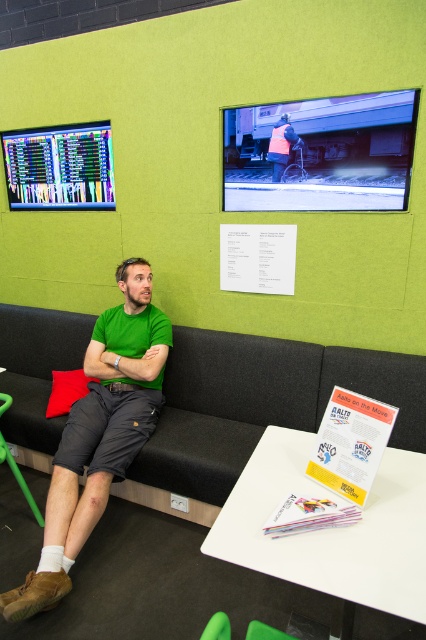
Which is more to the right, white glossy table at lower right or green matte shirt at center?

From the viewer's perspective, white glossy table at lower right appears more on the right side.

What do you see at coordinates (331, 529) in the screenshot? I see `white glossy table at lower right` at bounding box center [331, 529].

Identify the location of white glossy table at lower right. This screenshot has height=640, width=426. (x=331, y=529).

Which is more to the right, white glossy table at lower right or matte black screen at upper left?

white glossy table at lower right

Who is taller, white glossy table at lower right or matte black screen at upper left?

Standing taller between the two is matte black screen at upper left.

At what (x,y) coordinates should I click in order to perform the action: click on white glossy table at lower right. Please return your answer as a coordinate pair (x, y). The image size is (426, 640). Looking at the image, I should click on (331, 529).

Which of these two, green matte shirt at center or white paper poster at center, stands shorter?

Standing shorter between the two is white paper poster at center.

Can you confirm if green matte shirt at center is bigger than white paper poster at center?

Yes, green matte shirt at center is bigger than white paper poster at center.

Identify the location of green matte shirt at center. The height and width of the screenshot is (640, 426). (98, 433).

Image resolution: width=426 pixels, height=640 pixels. I want to click on green matte shirt at center, so tap(98, 433).